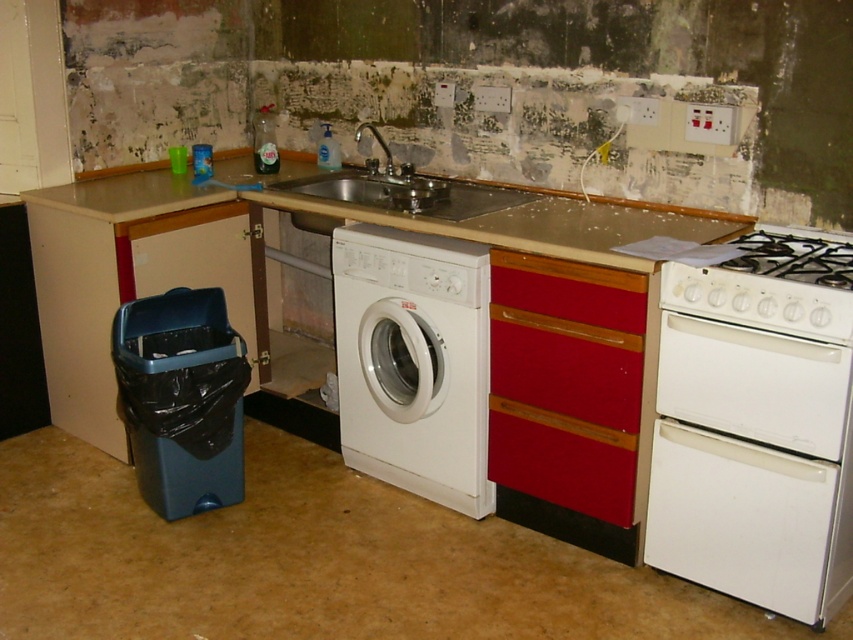
You are a repair technician entering the kitchen and need to access both the white matte washing machine at center and the matte red drawer at center. Which object should you approach first to reach the one farther away?

You should first approach the white matte washing machine at center because it is closer to you, allowing you to then reach the matte red drawer at center which is farther away.

You are a repair technician who needs to access the white matte washing machine at center for maintenance. Considering the space between you and the washing machine, can you comfortably perform tasks that require reaching forward 1.5 meters?

The distance between you and the white matte washing machine at center is 2.63 meters, which is more than enough space to comfortably reach forward 1.5 meters for maintenance tasks.